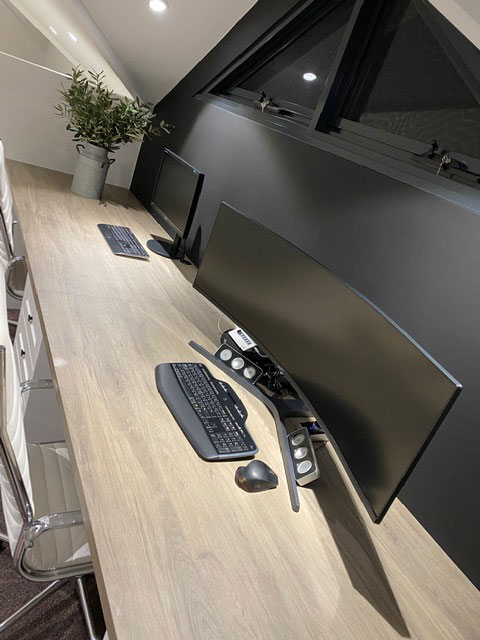
Where is `background dark gray wall`? The image size is (480, 640). background dark gray wall is located at coordinates (199, 146), (302, 201), (442, 278), (451, 489), (209, 72), (264, 16).